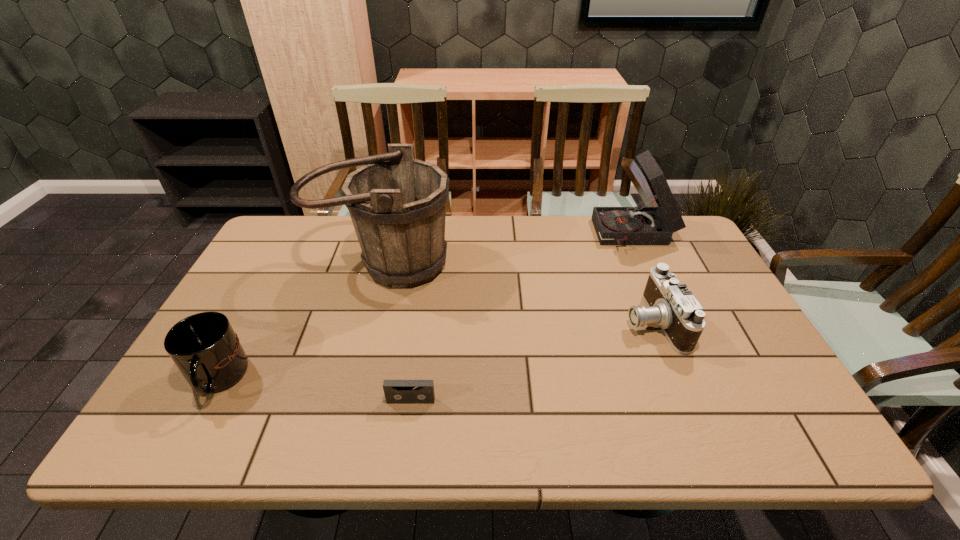
This screenshot has height=540, width=960. Identify the location of vacant area located 0.400m at the lens of the camera. (475, 322).

Identify the location of free space located 0.230m at the lens of the camera. This screenshot has height=540, width=960. click(x=539, y=322).

Where is `blank space located 0.240m at the lens of the camera`? The width and height of the screenshot is (960, 540). blank space located 0.240m at the lens of the camera is located at coordinates (535, 322).

This screenshot has height=540, width=960. What are the coordinates of `free region located on the front-facing side of the shortest object` in the screenshot? It's located at (405, 446).

Where is `bucket positioned at the far edge`? Image resolution: width=960 pixels, height=540 pixels. bucket positioned at the far edge is located at coordinates (397, 203).

Identify the location of phonograph_record at the far edge. (636, 225).

Find the location of a particular element. Image resolution: width=960 pixels, height=540 pixels. object that is at the left edge is located at coordinates (204, 347).

Identify the location of object located in the right edge section of the desktop. (636, 225).

Where is `object present at the far right corner`? object present at the far right corner is located at coordinates (636, 225).

In the image, there is a desktop. Where is `free space at the far edge`? This screenshot has height=540, width=960. free space at the far edge is located at coordinates (530, 219).